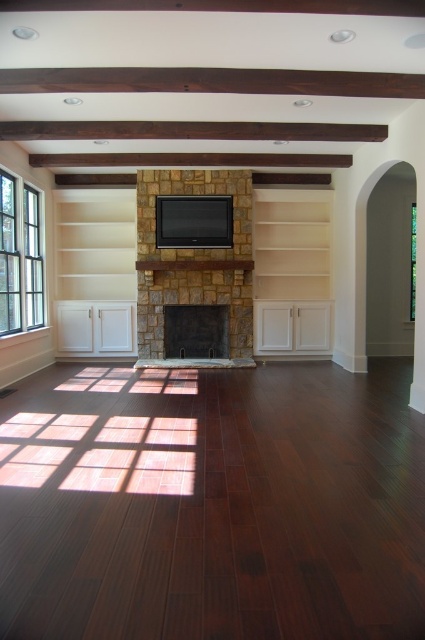
You are standing in the living room and want to determine which of the two points, point (161, 179) or point (414, 243), is closer to you. Based on the image, which point is nearer?

Point (161, 179) is further to the camera than point (414, 243). Therefore, point (414, 243) is closer to you.